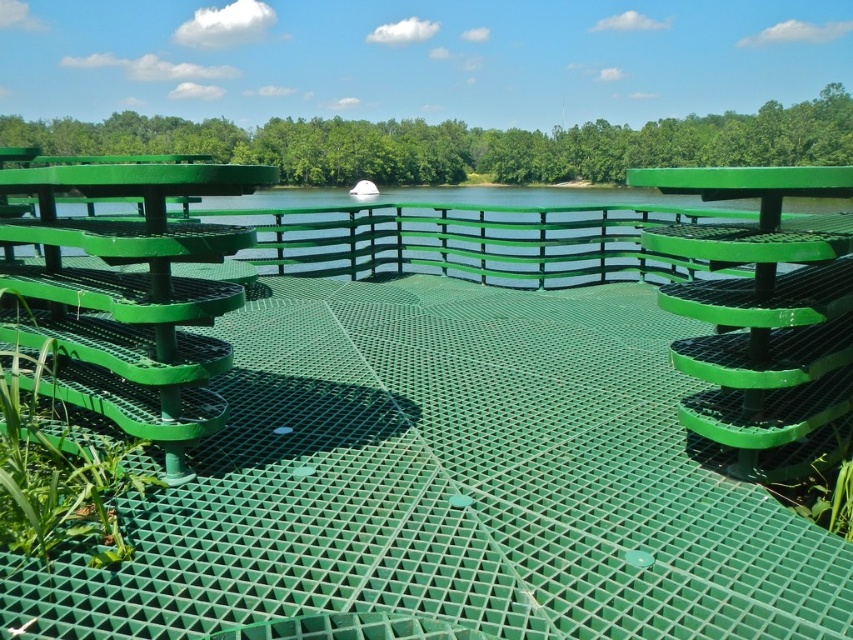
Question: Is green matte bench at center positioned before green mesh water at center?

Choices:
 (A) no
 (B) yes

Answer: (B)

Question: Which of the following is the closest to the observer?

Choices:
 (A) (169, 300)
 (B) (724, 460)

Answer: (A)

Question: Which point is closer to the camera?

Choices:
 (A) green matte bench at center
 (B) green mesh water at center

Answer: (A)

Question: Among these objects, which one is farthest from the camera?

Choices:
 (A) green plastic bench at upper left
 (B) green mesh water at center

Answer: (B)

Question: Does green plastic bench at upper left appear under green matte bench at center?

Choices:
 (A) yes
 (B) no

Answer: (A)

Question: Is green plastic bench at upper left above green matte bench at center?

Choices:
 (A) no
 (B) yes

Answer: (A)